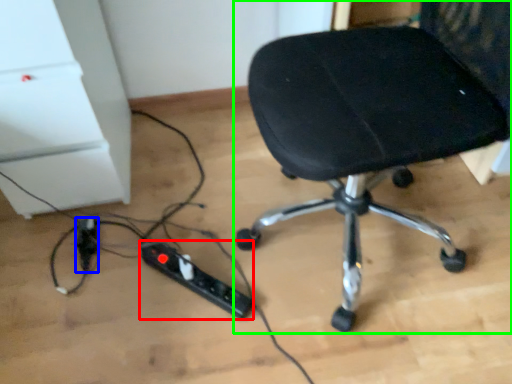
Question: Considering the real-world distances, which object is farthest from extension cord (highlighted by a red box)? extension cord (highlighted by a blue box) or chair (highlighted by a green box)?

Choices:
 (A) extension cord
 (B) chair

Answer: (B)